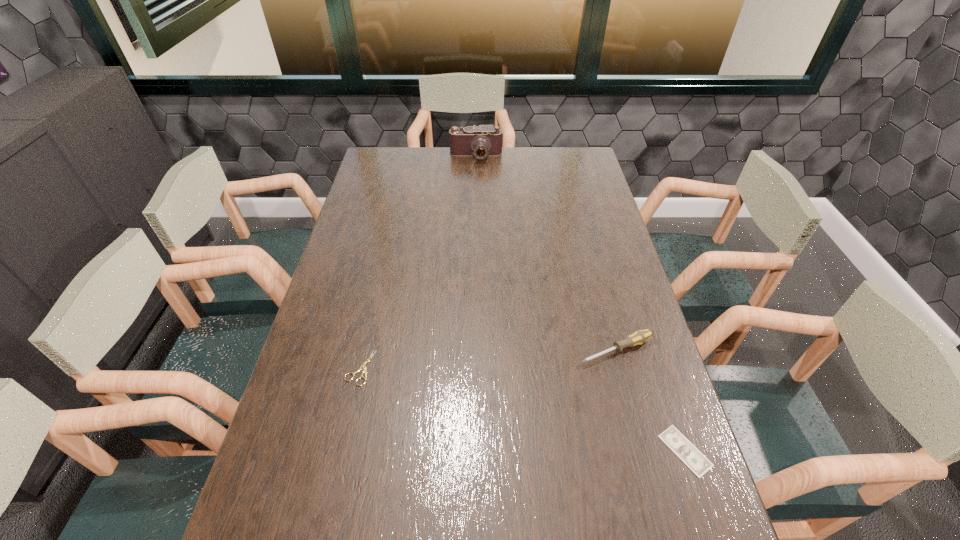
The width and height of the screenshot is (960, 540). Find the location of `free location at the near edge`. free location at the near edge is located at coordinates (366, 520).

The height and width of the screenshot is (540, 960). In order to click on blank space at the left edge in this screenshot , I will do `click(376, 210)`.

You are a GUI agent. You are given a task and a screenshot of the screen. Output one action in this format:
    pyautogui.click(x=<x>, y=<y>)
    Task: Click on the vacant area at the right edge of the desktop
    
    Given the screenshot: What is the action you would take?
    pyautogui.click(x=613, y=338)

Locate an element on the screen. free space at the far left corner is located at coordinates (394, 176).

Where is `free space at the near left corner`? Image resolution: width=960 pixels, height=540 pixels. free space at the near left corner is located at coordinates (259, 501).

Identify the location of free space between the shortest object and the third shortest object. (651, 400).

Find the location of a particular element. free spot between the shortest object and the second shortest object is located at coordinates (522, 409).

At what (x,y) coordinates should I click in order to perform the action: click on empty space that is in between the screwdriver and the camera. Please return your answer as a coordinate pair (x, y). This screenshot has height=540, width=960. Looking at the image, I should click on (546, 253).

Image resolution: width=960 pixels, height=540 pixels. Identify the location of free space between the camera and the leftmost object. (418, 262).

Where is `empty space between the nearest object and the second tallest object`? empty space between the nearest object and the second tallest object is located at coordinates (651, 400).